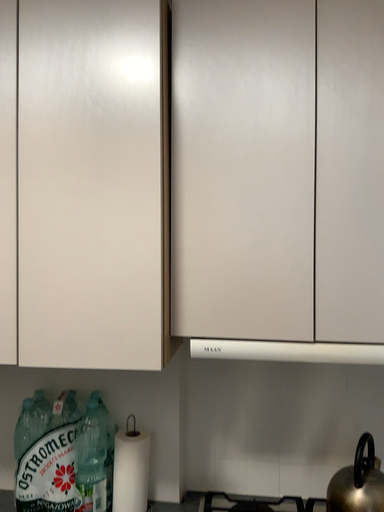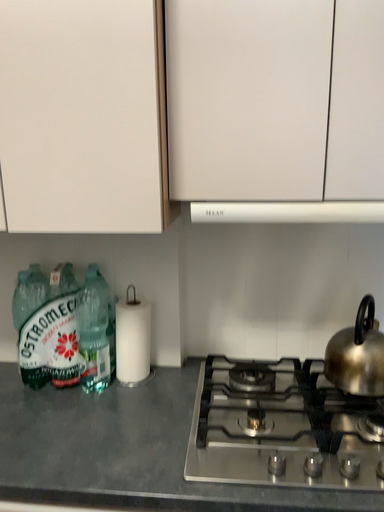
Question: Which way did the camera rotate in the video?

Choices:
 (A) rotated upward
 (B) rotated downward

Answer: (B)